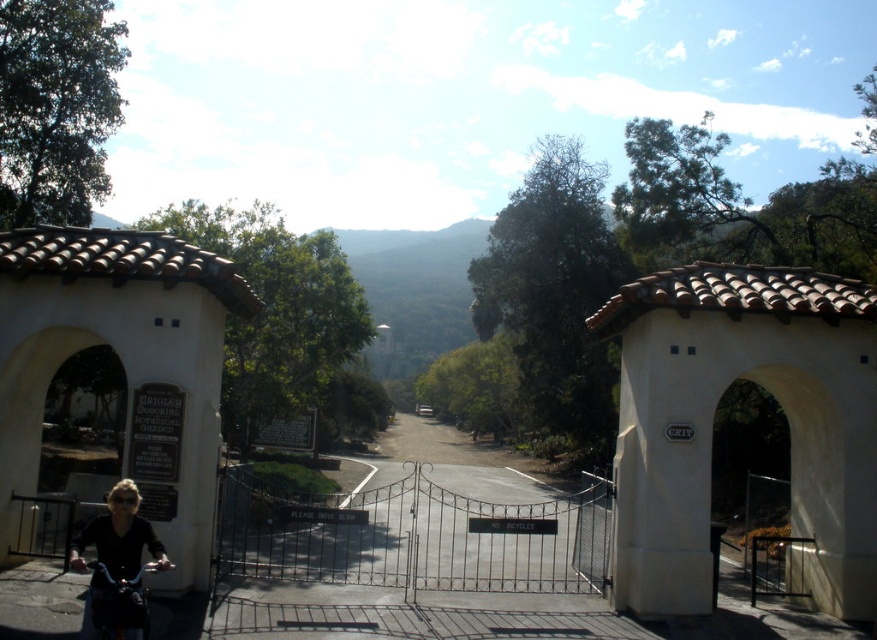
What is the spatial relationship between the black matte jacket at lower left and the shiny black bicycle at lower left in the botanical garden entrance scene?

The black matte jacket at lower left is positioned to the left of the shiny black bicycle at lower left.

You are a visitor arriving at the Crigler Memorial Botanical Garden entrance. You notice a black matte jacket at lower left and a shiny black bicycle at lower left. The garden has a rule that all items must be at least 4 inches apart for safety. Are the two items meeting this requirement?

The distance between the black matte jacket at lower left and the shiny black bicycle at lower left is 3.22 inches, which is less than the required 4 inches. Therefore, they are not meeting the safety requirement.

You are a visitor approaching the entrance of the Crigler Memorial Botanical Garden. You see a black matte jacket at lower left and a shiny black bicycle at lower left. Which object is closer to you as you approach the entrance?

The black matte jacket at lower left is closer to you because it is further to the viewer than the shiny black bicycle at lower left.